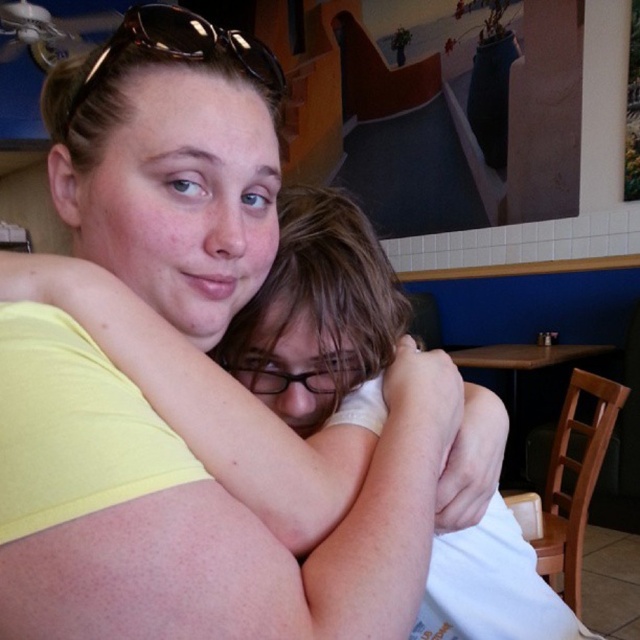
Question: Does yellow matte shirt at center appear over brown plastic sunglasses at upper center?

Choices:
 (A) no
 (B) yes

Answer: (A)

Question: Observing the image, what is the correct spatial positioning of yellow matte shirt at center in reference to brown plastic sunglasses at upper center?

Choices:
 (A) below
 (B) above

Answer: (A)

Question: Does yellow matte shirt at center have a lesser width compared to brown plastic sunglasses at upper center?

Choices:
 (A) no
 (B) yes

Answer: (A)

Question: Which of the following is the farthest from the observer?

Choices:
 (A) brown plastic sunglasses at upper center
 (B) yellow matte shirt at center

Answer: (A)

Question: Which object appears farthest from the camera in this image?

Choices:
 (A) yellow matte shirt at center
 (B) brown plastic sunglasses at upper center

Answer: (B)